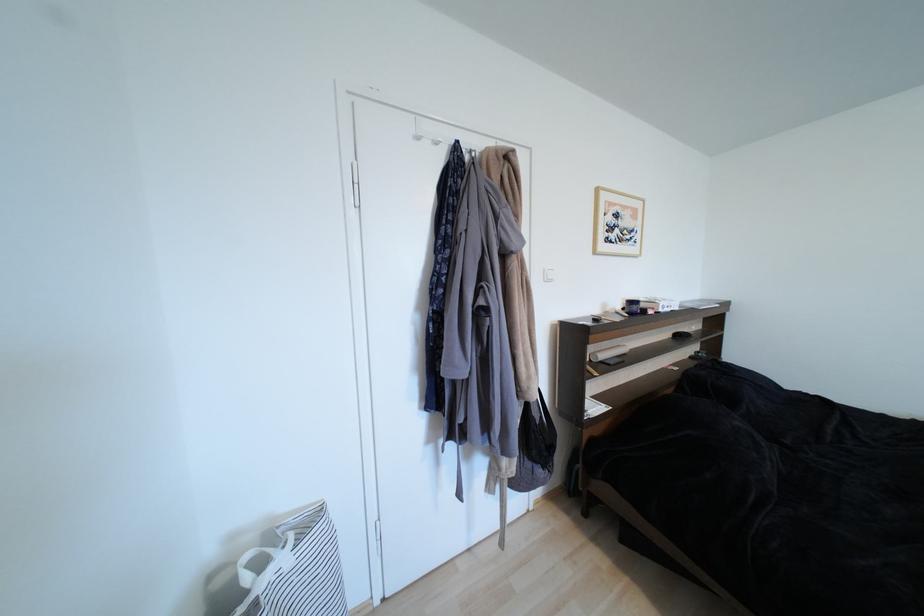
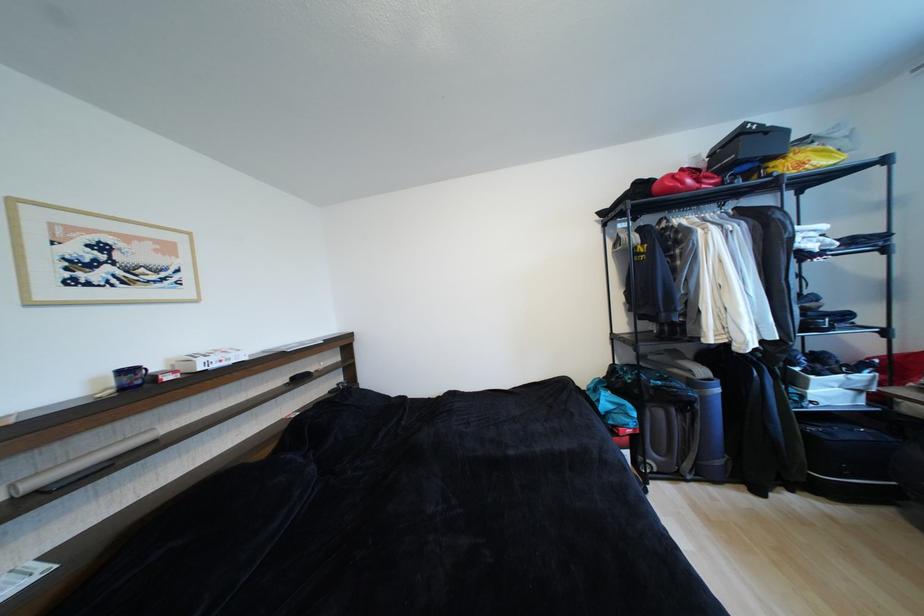
Where in the second image is the point corresponding to point (638, 304) from the first image?

(134, 373)